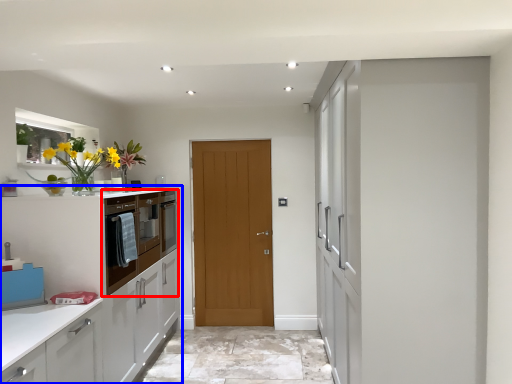
Question: Which point is closer to the camera, cabinetry (highlighted by a red box) or cabinetry (highlighted by a blue box)?

Choices:
 (A) cabinetry
 (B) cabinetry

Answer: (B)